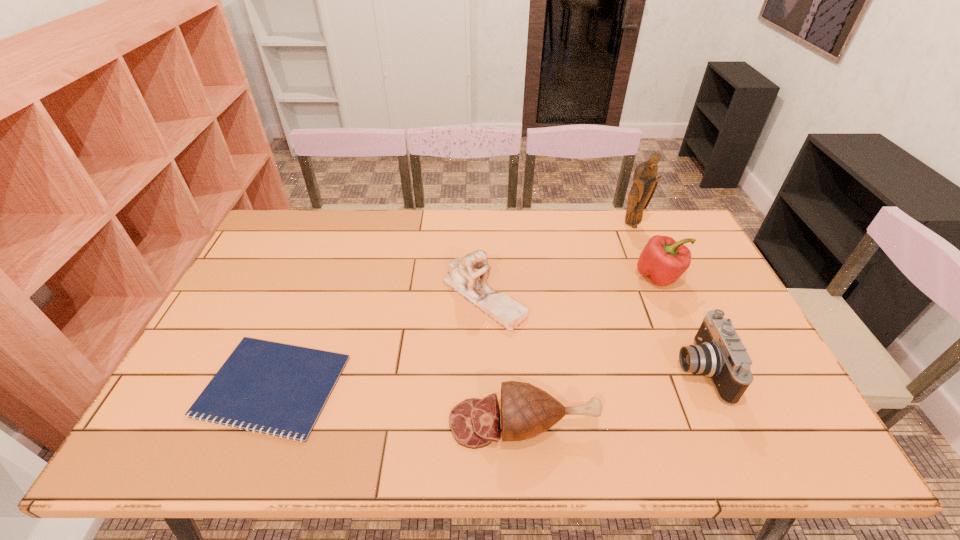
Find the location of a particular element. ham that is at the near edge is located at coordinates (527, 411).

Identify the location of notepad at the near edge. (276, 386).

Locate an element on the screen. object situated at the left edge is located at coordinates (276, 386).

Find the location of `figurine positioned at the right edge`. figurine positioned at the right edge is located at coordinates (645, 182).

Find the location of a particular element. bell pepper that is at the right edge is located at coordinates (663, 260).

Image resolution: width=960 pixels, height=540 pixels. I want to click on camera present at the right edge, so click(718, 353).

Identify the location of object present at the near left corner. (276, 386).

Find the location of a particular element. Image resolution: width=960 pixels, height=540 pixels. object present at the far right corner is located at coordinates (645, 182).

Identify the location of free space at the far edge of the desktop. (493, 212).

Where is `free space at the left edge`? free space at the left edge is located at coordinates (255, 295).